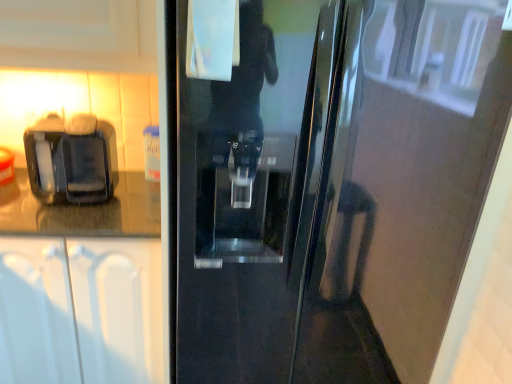
Question: Is white matte cabinet at left positioned with its back to black plastic coffee machine at left?

Choices:
 (A) no
 (B) yes

Answer: (A)

Question: Can you confirm if white matte cabinet at left is positioned to the right of black plastic coffee machine at left?

Choices:
 (A) no
 (B) yes

Answer: (A)

Question: Does white matte cabinet at left lie in front of black plastic coffee machine at left?

Choices:
 (A) yes
 (B) no

Answer: (A)

Question: From the image's perspective, would you say white matte cabinet at left is shown under black plastic coffee machine at left?

Choices:
 (A) no
 (B) yes

Answer: (B)

Question: Is white matte cabinet at left thinner than black plastic coffee machine at left?

Choices:
 (A) yes
 (B) no

Answer: (B)

Question: In terms of height, does white matte cabinet at left look taller or shorter compared to glossy black refrigerator at center?

Choices:
 (A) short
 (B) tall

Answer: (A)

Question: Is white matte cabinet at left inside the boundaries of glossy black refrigerator at center, or outside?

Choices:
 (A) inside
 (B) outside

Answer: (B)

Question: In the image, is white matte cabinet at left on the left side or the right side of glossy black refrigerator at center?

Choices:
 (A) left
 (B) right

Answer: (A)

Question: Considering the positions of white matte cabinet at left and glossy black refrigerator at center in the image, is white matte cabinet at left wider or thinner than glossy black refrigerator at center?

Choices:
 (A) thin
 (B) wide

Answer: (A)

Question: Is black plastic coffee machine at left taller or shorter than white matte cabinet at left?

Choices:
 (A) tall
 (B) short

Answer: (B)

Question: Is point (53, 127) closer or farther from the camera than point (103, 304)?

Choices:
 (A) closer
 (B) farther

Answer: (A)

Question: Is black plastic coffee machine at left in front of or behind white matte cabinet at left in the image?

Choices:
 (A) behind
 (B) front

Answer: (A)

Question: From the image's perspective, relative to white matte cabinet at left, is black plastic coffee machine at left above or below?

Choices:
 (A) below
 (B) above

Answer: (B)

Question: Visually, is glossy black refrigerator at center positioned to the left or to the right of white matte cabinet at left?

Choices:
 (A) left
 (B) right

Answer: (B)

Question: From the image's perspective, is glossy black refrigerator at center located above or below white matte cabinet at left?

Choices:
 (A) above
 (B) below

Answer: (A)